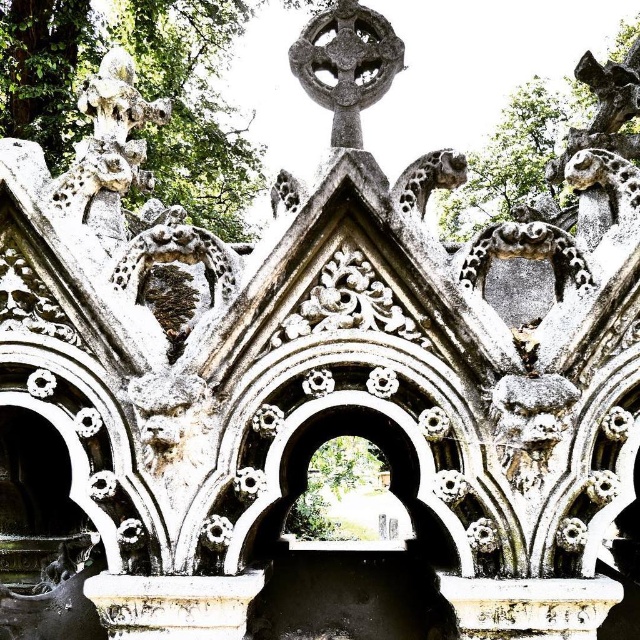
Describe the element at coordinates (108, 147) in the screenshot. I see `white stone dragon at upper left` at that location.

Which is in front, point (92, 77) or point (333, 35)?

Point (333, 35) is in front.

Is point (134, 179) more distant than point (317, 29)?

Yes.

This screenshot has width=640, height=640. I want to click on white stone dragon at upper left, so click(108, 147).